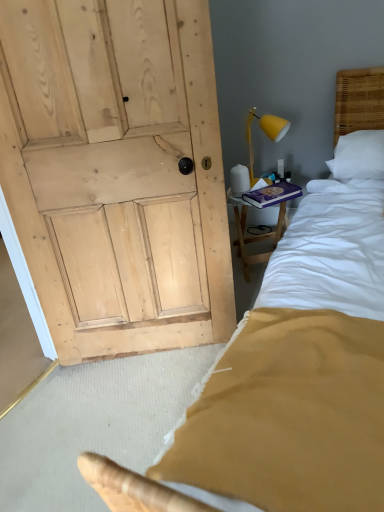
Question: Is wooden bedside table at right aimed at purple hardcover book at upper right?

Choices:
 (A) yes
 (B) no

Answer: (B)

Question: From a real-world perspective, is wooden bedside table at right positioned under purple hardcover book at upper right based on gravity?

Choices:
 (A) no
 (B) yes

Answer: (B)

Question: Is wooden bedside table at right behind purple hardcover book at upper right?

Choices:
 (A) no
 (B) yes

Answer: (B)

Question: Is wooden bedside table at right beside purple hardcover book at upper right?

Choices:
 (A) no
 (B) yes

Answer: (A)

Question: Is wooden bedside table at right positioned before purple hardcover book at upper right?

Choices:
 (A) yes
 (B) no

Answer: (B)

Question: Does wooden bedside table at right have a greater height compared to purple hardcover book at upper right?

Choices:
 (A) yes
 (B) no

Answer: (A)

Question: Is purple hardcover book at upper right outside of yellow matte lamp at upper right?

Choices:
 (A) no
 (B) yes

Answer: (B)

Question: Is purple hardcover book at upper right oriented away from yellow matte lamp at upper right?

Choices:
 (A) no
 (B) yes

Answer: (A)

Question: Does purple hardcover book at upper right turn towards yellow matte lamp at upper right?

Choices:
 (A) yes
 (B) no

Answer: (B)

Question: Is the surface of purple hardcover book at upper right in direct contact with yellow matte lamp at upper right?

Choices:
 (A) no
 (B) yes

Answer: (A)

Question: Is the depth of purple hardcover book at upper right greater than that of yellow matte lamp at upper right?

Choices:
 (A) no
 (B) yes

Answer: (B)

Question: Considering the relative sizes of purple hardcover book at upper right and yellow matte lamp at upper right in the image provided, is purple hardcover book at upper right thinner than yellow matte lamp at upper right?

Choices:
 (A) yes
 (B) no

Answer: (B)

Question: Does wooden bedside table at right have a larger size compared to yellow matte lamp at upper right?

Choices:
 (A) yes
 (B) no

Answer: (A)